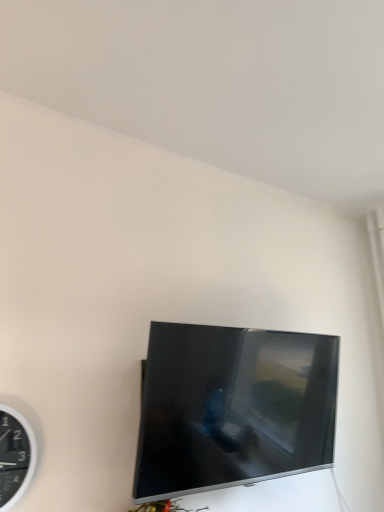
Question: In the image, is black plastic wall clock at left positioned in front of or behind satin black tv at center?

Choices:
 (A) behind
 (B) front

Answer: (B)

Question: In terms of size, does black plastic wall clock at left appear bigger or smaller than satin black tv at center?

Choices:
 (A) big
 (B) small

Answer: (B)

Question: Which is correct: black plastic wall clock at left is inside satin black tv at center, or outside of it?

Choices:
 (A) outside
 (B) inside

Answer: (A)

Question: Based on their positions, is satin black tv at center located to the left or right of black plastic wall clock at left?

Choices:
 (A) right
 (B) left

Answer: (A)

Question: From the image's perspective, is satin black tv at center positioned above or below black plastic wall clock at left?

Choices:
 (A) above
 (B) below

Answer: (A)

Question: From their relative heights in the image, would you say satin black tv at center is taller or shorter than black plastic wall clock at left?

Choices:
 (A) tall
 (B) short

Answer: (A)

Question: From a real-world perspective, is satin black tv at center positioned above or below black plastic wall clock at left?

Choices:
 (A) above
 (B) below

Answer: (A)